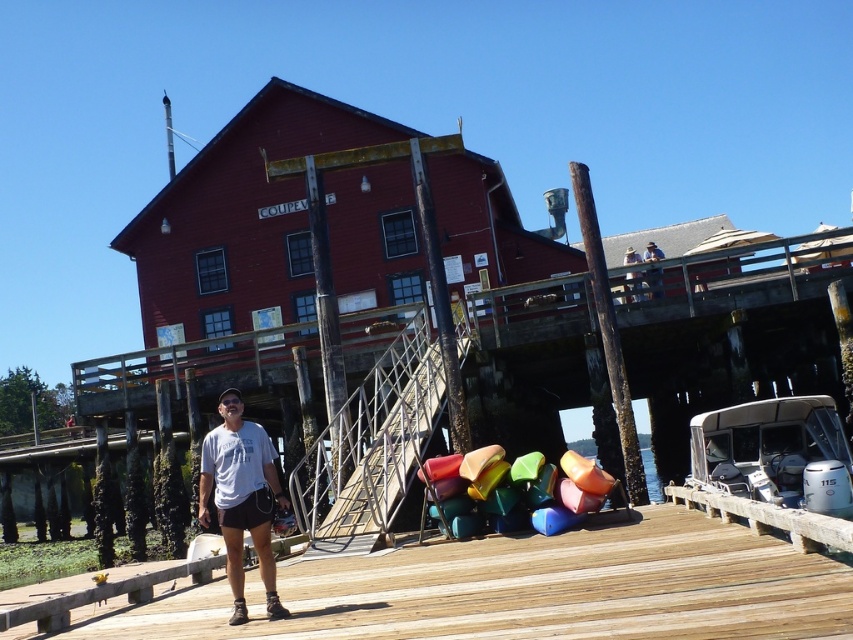
You are standing at the wooden dock in the waterfront scene. You see a point marked at coordinates (654,282). What object is located at this point?

The point at coordinates (654,282) is on blue denim jeans at upper center.